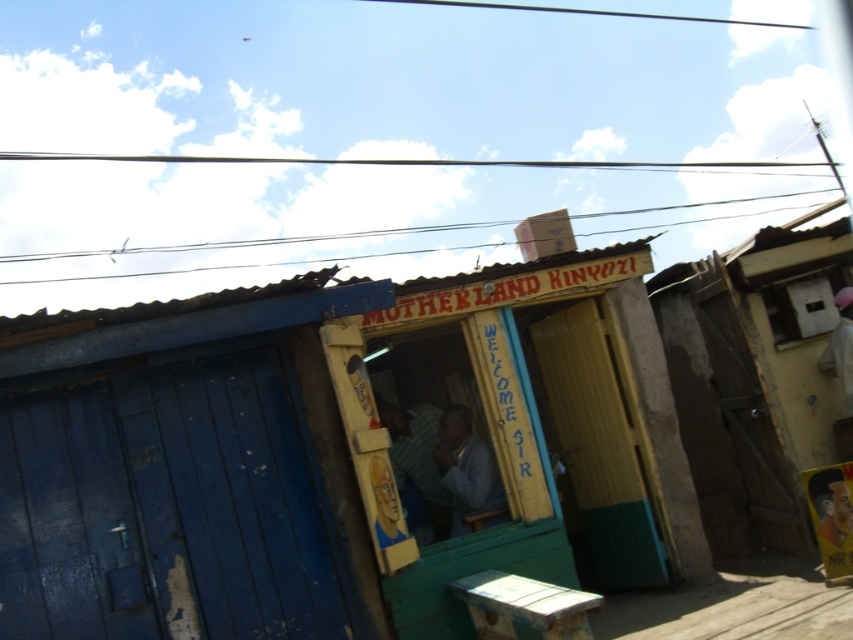
Question: Among these points, which one is nearest to the camera?

Choices:
 (A) (708, 428)
 (B) (624, 456)
 (C) (451, 490)

Answer: (C)

Question: Does brown corrugated metal hut at center have a larger size compared to light blue fabric at center?

Choices:
 (A) no
 (B) yes

Answer: (B)

Question: Which object appears farthest from the camera in this image?

Choices:
 (A) wooden hut at center
 (B) light blue fabric at center

Answer: (B)

Question: Which point is closer to the camera taking this photo?

Choices:
 (A) (795, 292)
 (B) (477, 442)

Answer: (B)

Question: Does wooden hut at center come behind brown corrugated metal hut at center?

Choices:
 (A) yes
 (B) no

Answer: (B)

Question: Can you confirm if wooden hut at center is positioned to the left of light blue fabric at center?

Choices:
 (A) yes
 (B) no

Answer: (A)